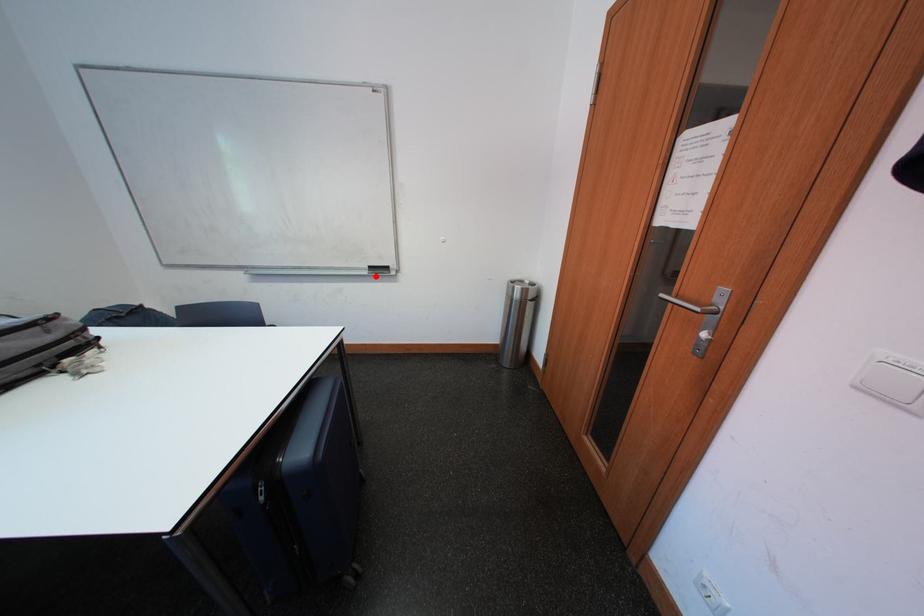
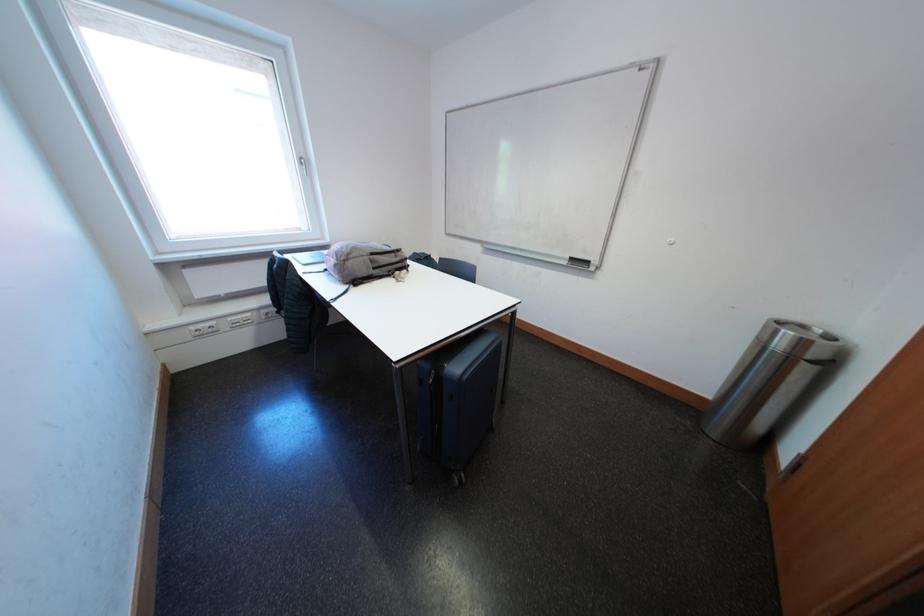
In the second image, find the point that corresponds to the highlighted location in the first image.

(575, 267)